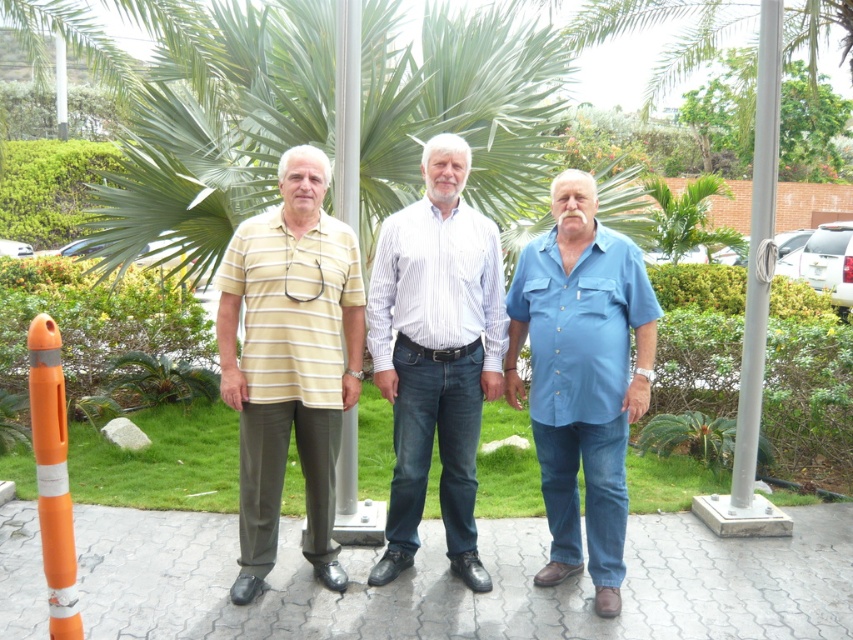
Question: Among these points, which one is farthest from the camera?

Choices:
 (A) (408, 390)
 (B) (555, 476)

Answer: (B)

Question: Is striped cotton polo shirt at center bigger than orange matte traffic cone at left?

Choices:
 (A) no
 (B) yes

Answer: (B)

Question: From the image, what is the correct spatial relationship of yellow striped shirt at center in relation to metallic pole at center?

Choices:
 (A) above
 (B) below

Answer: (B)

Question: Which of the following is the closest to the observer?

Choices:
 (A) blue cotton shirt at center
 (B) striped cotton polo shirt at center
 (C) white metallic pole at upper right

Answer: (A)

Question: Does blue cotton shirt at center lie in front of metallic pole at center?

Choices:
 (A) no
 (B) yes

Answer: (B)

Question: Which of these objects is positioned farthest from the white striped shirt at center?

Choices:
 (A) green leafy palm tree at center
 (B) blue cotton shirt at center
 (C) white metallic pole at upper right
 (D) orange matte traffic cone at left

Answer: (A)